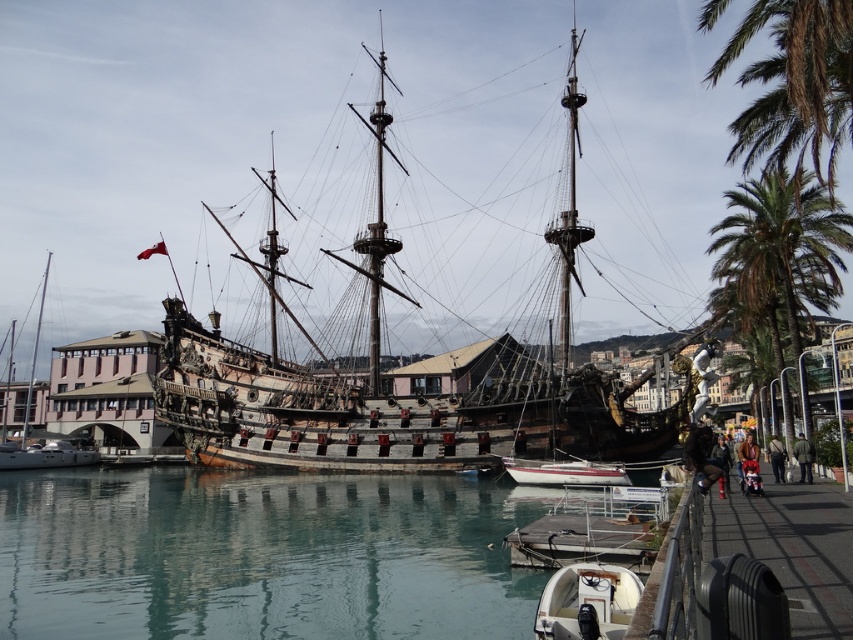
Which of these two, clear water at center or white glossy sailboat at left, stands taller?

white glossy sailboat at left is taller.

Between clear water at center and white glossy sailboat at left, which one has less height?

With less height is clear water at center.

What do you see at coordinates (262, 556) in the screenshot? This screenshot has width=853, height=640. I see `clear water at center` at bounding box center [262, 556].

At what (x,y) coordinates should I click in order to perform the action: click on clear water at center. Please return your answer as a coordinate pair (x, y). Looking at the image, I should click on coord(262,556).

In the scene shown: Between green leafy palm tree at right and white glossy sailboat at left, which one appears on the left side from the viewer's perspective?

From the viewer's perspective, white glossy sailboat at left appears more on the left side.

Between point (782, 234) and point (16, 464), which one is positioned behind?

Point (16, 464)

Locate an element on the screen. This screenshot has height=640, width=853. green leafy palm tree at right is located at coordinates (780, 253).

Does clear water at center have a smaller size compared to green leafy palm tree at right?

Incorrect, clear water at center is not smaller in size than green leafy palm tree at right.

Is clear water at center thinner than green leafy palm tree at right?

No.

Is point (113, 468) in front of point (807, 230)?

No.

Find the location of `clear water at center`. clear water at center is located at coordinates (262, 556).